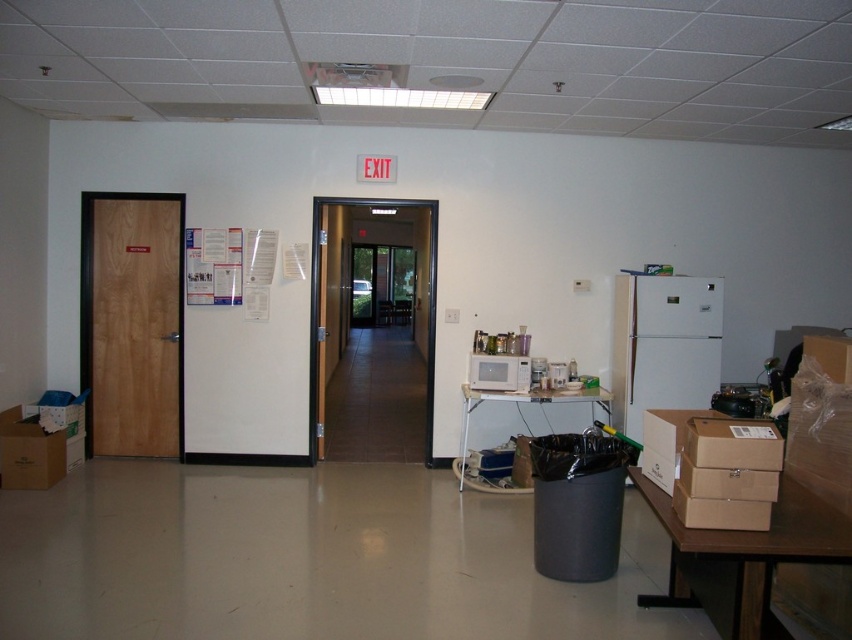
Question: From the image, what is the correct spatial relationship of wooden door at left in relation to brown wooden door at center?

Choices:
 (A) below
 (B) above

Answer: (B)

Question: Based on their relative distances, which object is farther from the brown wooden door at center?

Choices:
 (A) wooden door at left
 (B) white paperboard bulletin board at upper left

Answer: (A)

Question: Can you confirm if wooden door at left is positioned above white paperboard bulletin board at upper left?

Choices:
 (A) yes
 (B) no

Answer: (B)

Question: Is wooden door at left to the right of white paperboard bulletin board at upper left from the viewer's perspective?

Choices:
 (A) no
 (B) yes

Answer: (A)

Question: Estimate the real-world distances between objects in this image. Which object is farther from the white paperboard bulletin board at upper left?

Choices:
 (A) brown wooden door at center
 (B) wooden door at left

Answer: (A)

Question: Which point is farther to the camera?

Choices:
 (A) (392, 205)
 (B) (194, 236)

Answer: (A)